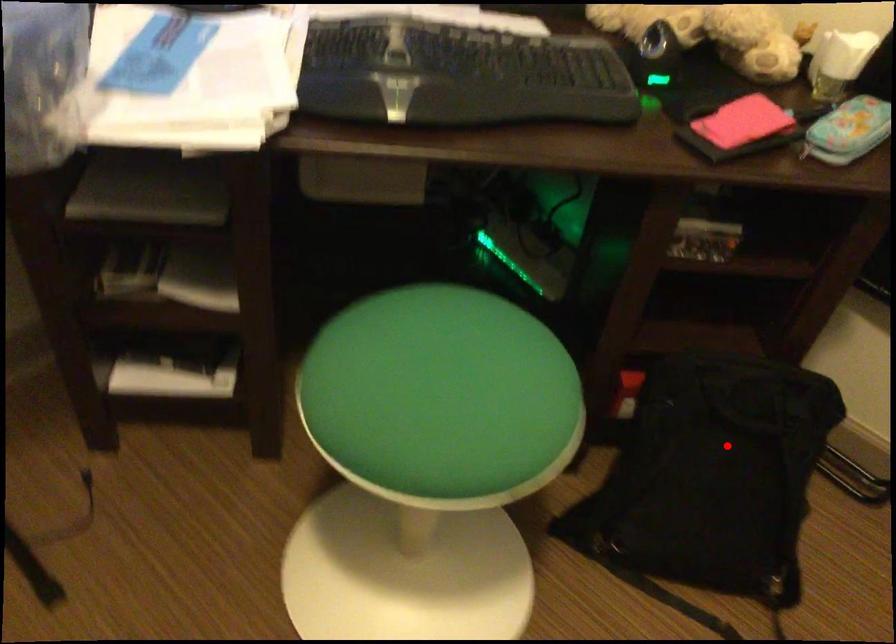
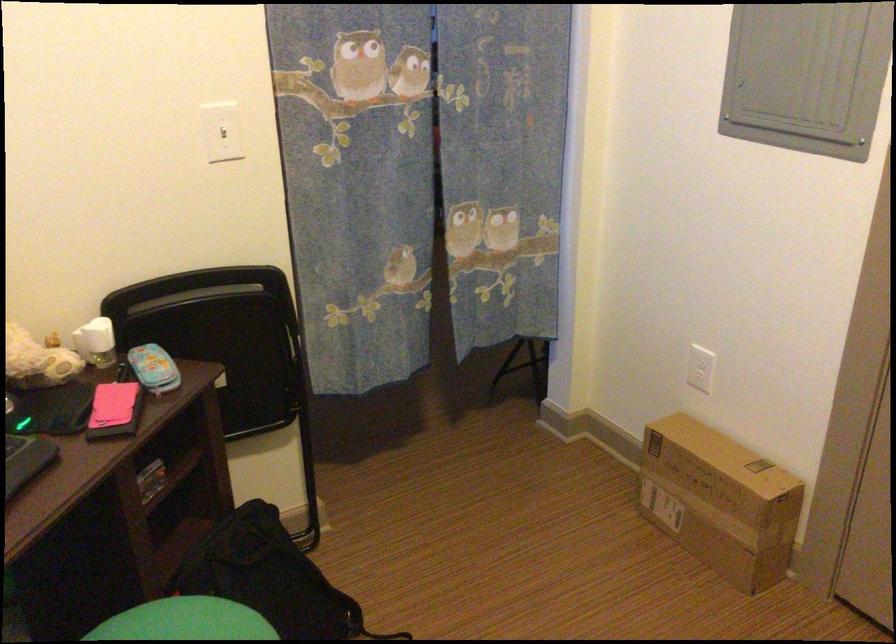
Where in the second image is the point corresponding to the highlighted location from the first image?

(270, 576)